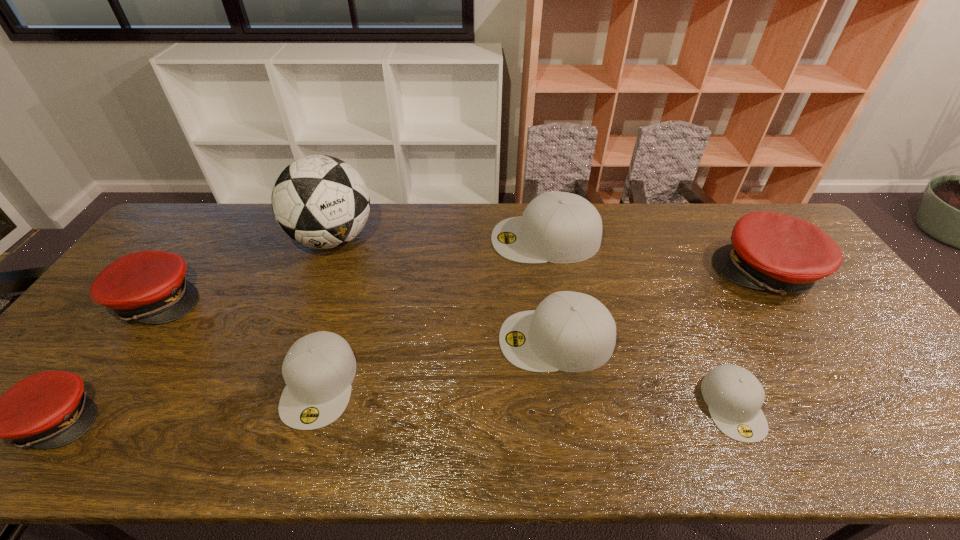
Image resolution: width=960 pixels, height=540 pixels. I want to click on black soccer ball, so click(320, 201).

At what (x,y) coordinates should I click in order to perform the action: click on soccer ball. Please return your answer as a coordinate pair (x, y). This screenshot has height=540, width=960. Looking at the image, I should click on (320, 201).

At what (x,y) coordinates should I click in order to perform the action: click on the biggest gray cap. Please return your answer as a coordinate pair (x, y). This screenshot has width=960, height=540. Looking at the image, I should click on (558, 227).

Identify the location of the rightmost cap. (770, 251).

The height and width of the screenshot is (540, 960). Identify the location of the rightmost object. (770, 251).

Where is `the third smallest gray cap`? The height and width of the screenshot is (540, 960). the third smallest gray cap is located at coordinates (569, 331).

Image resolution: width=960 pixels, height=540 pixels. I want to click on the second smallest red cap, so click(x=149, y=286).

Identify the location of the second smallest gray cap. The height and width of the screenshot is (540, 960). (319, 368).

You are a GUI agent. You are given a task and a screenshot of the screen. Output one action in this format:
    pyautogui.click(x=<x>, y=<y>)
    Task: Click on the leftmost gray cap
    
    Given the screenshot: What is the action you would take?
    pyautogui.click(x=319, y=368)

At what (x,y) coordinates should I click in order to perform the action: click on the seventh object from left to right. Please return your answer as a coordinate pair (x, y). Looking at the image, I should click on (734, 396).